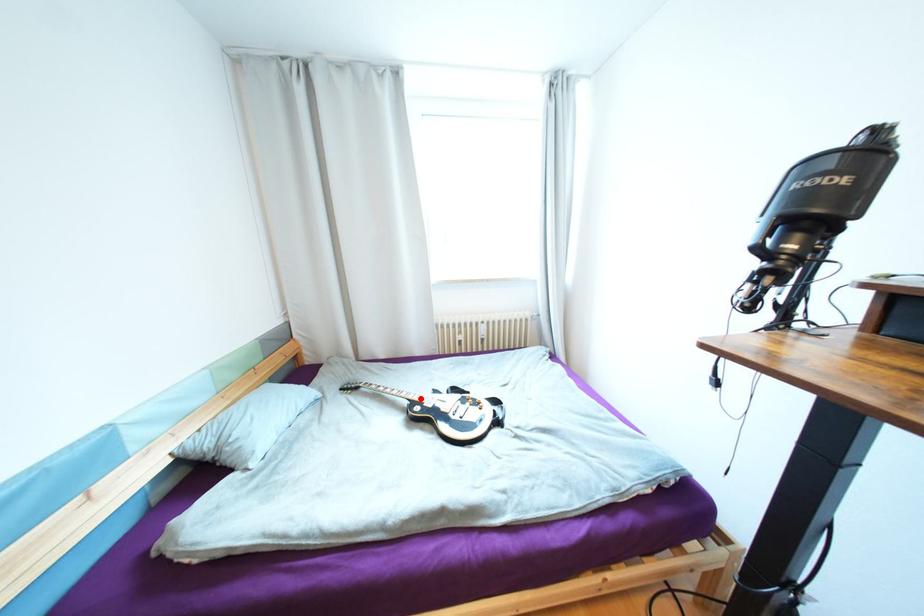
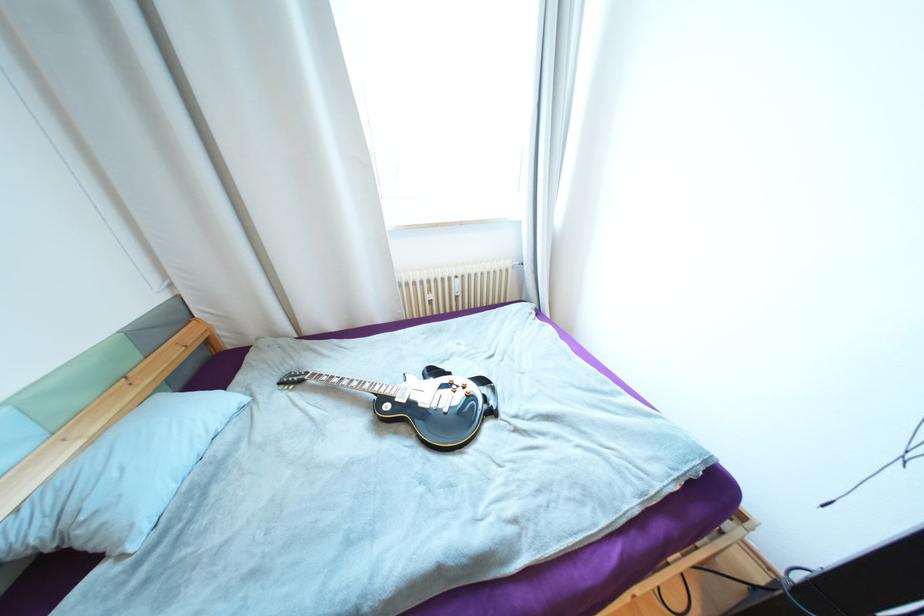
Find the pixel in the second image that matches the highlighted location in the first image.

(387, 391)